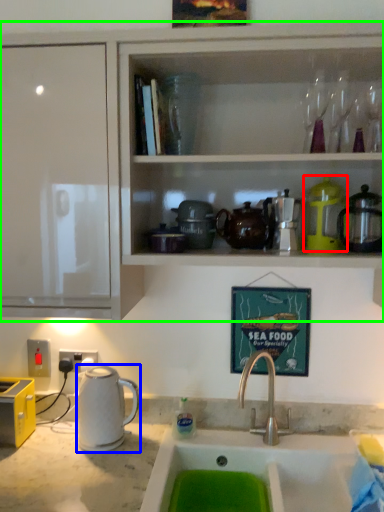
Question: Considering the real-world distances, which object is closest to appliance (highlighted by a red box)? kitchen appliance (highlighted by a blue box) or cabinetry (highlighted by a green box).

Choices:
 (A) kitchen appliance
 (B) cabinetry

Answer: (B)